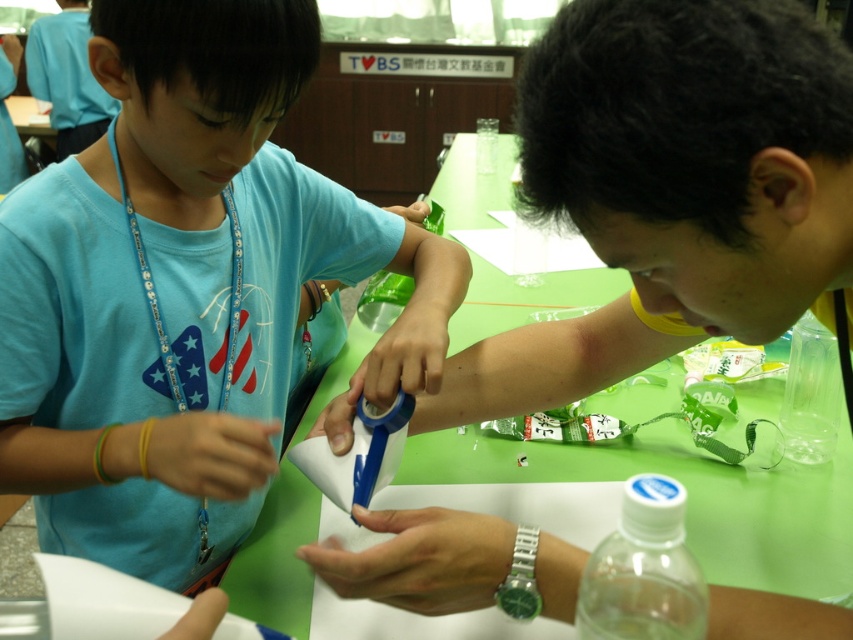
You are organizing a workshop and need to place the blue matte tape dispenser at center and the clear plastic bottle at center on a shelf. If the shelf has limited space, which object should you place first to ensure both fit?

The clear plastic bottle at center is smaller than the blue matte tape dispenser at center, so you should place the blue matte tape dispenser at center first to accommodate its larger size, then the clear plastic bottle at center will fit alongside.

Looking at this image, you are organizing a craft fair and need to place both the green plastic table at center and the transparent plastic bottle at center on a shelf. The shelf has limited space. Which object should you place first to ensure both fit properly?

You should place the green plastic table at center first because it is larger than the transparent plastic bottle at center, and larger items are typically placed first to accommodate smaller ones around them.